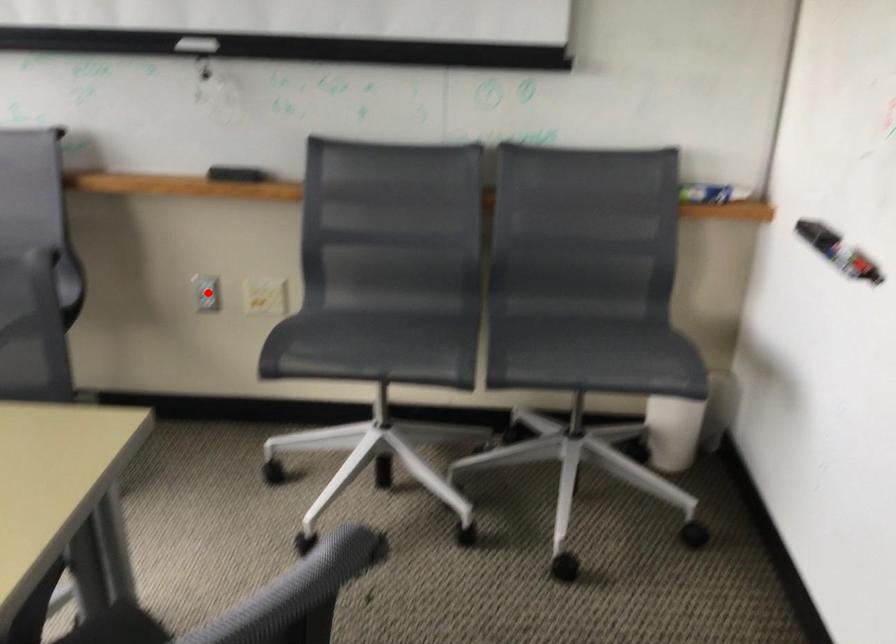
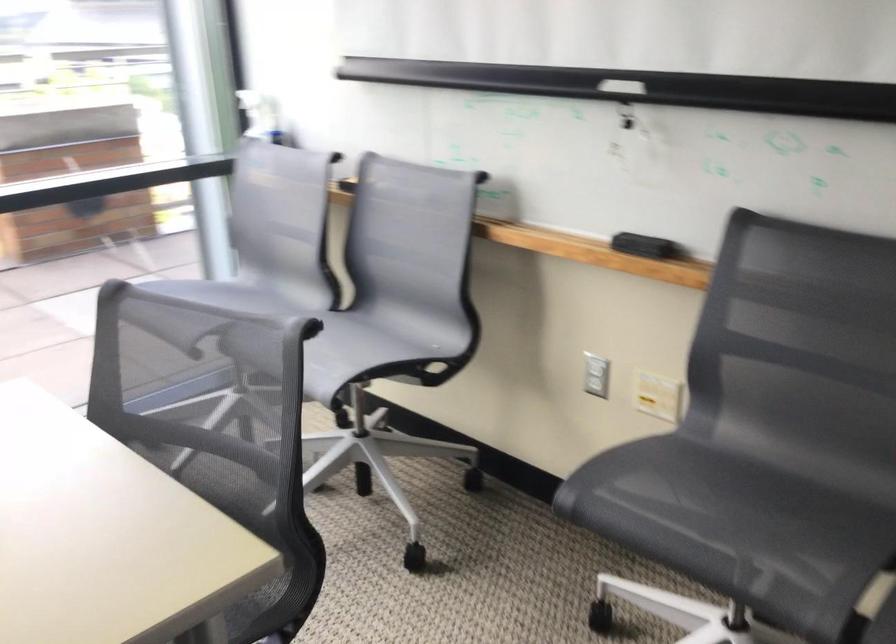
Where in the second image is the point corresponding to the highlighted location from the first image?

(596, 375)